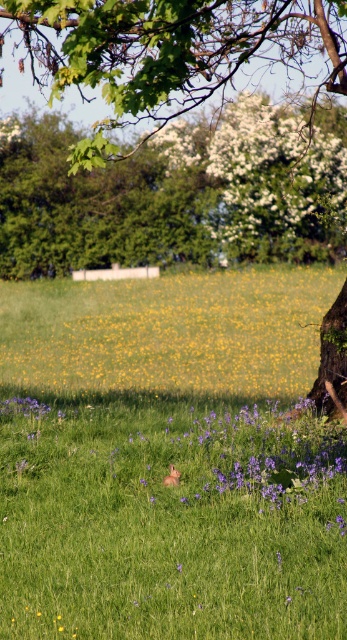
You are standing in the field and see the yellow matte flower at center and the white matte flower at upper center. Which one is positioned to the left of the other?

The yellow matte flower at center is positioned to the left of the white matte flower at upper center.

You are a gardener planning to plant a new flower bed between the yellow matte flower at center and the brown textured tree at center right. Based on their positions, where should you place the new flower bed to ensure it is between both objects?

Result: The yellow matte flower at center is to the left of the brown textured tree at center right, so the new flower bed should be placed between them along the horizontal axis, positioned to the right of the yellow matte flower at center and to the left of the brown textured tree at center right.

In the serene landscape with grassy areas and yellow flowers, there is a point marked at coordinates (171, 522). What object is located at this point?

The point at coordinates (171, 522) corresponds to the brown furry rabbit at center.